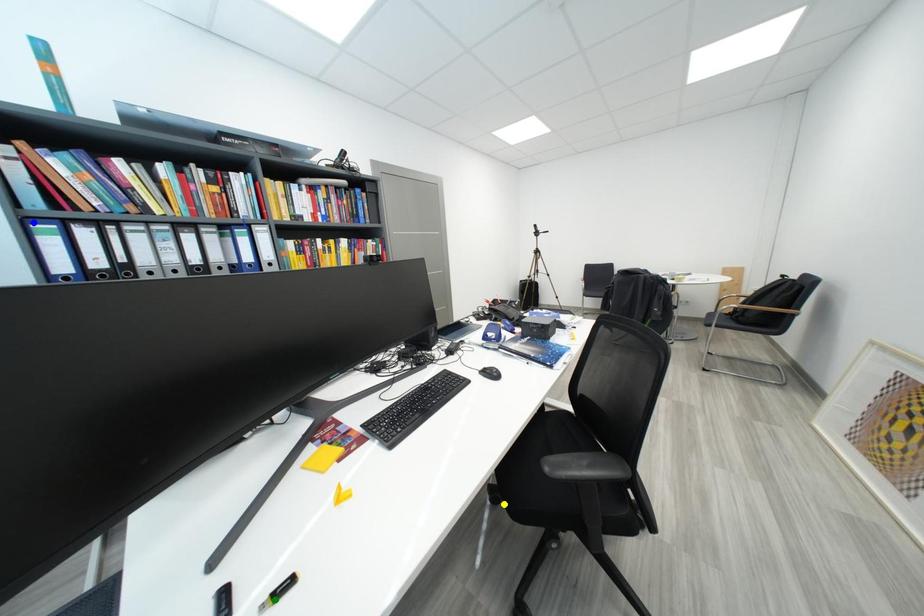
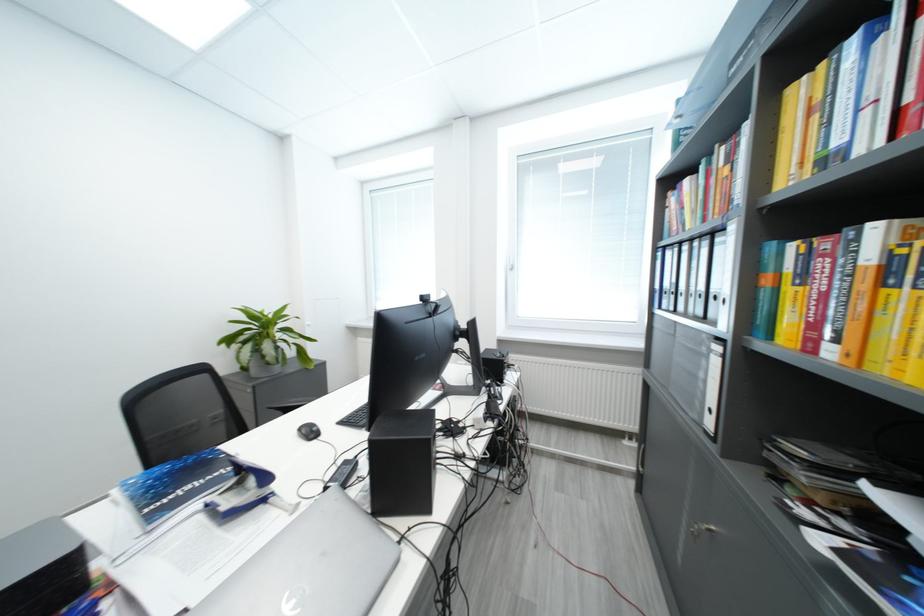
I am providing you with two images of the same scene from different viewpoints. Three points are marked in image1. Which point corresponds to a part or object that is occluded in image2?In image1, three points are marked. Which of them correspond to a part or object that is occluded in image2?Among the three points shown in image1, which one corresponds to a part or object that is no longer visible due to occlusion in image2?

green point, yellow point cannot be seen in image2.